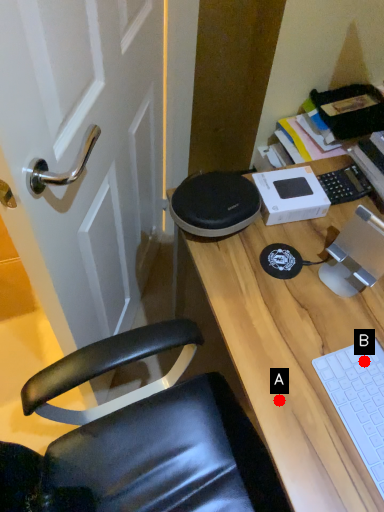
Question: Two points are circled on the image, labeled by A and B beside each circle. Which point is farther to the camera?

Choices:
 (A) A is further
 (B) B is further

Answer: (B)